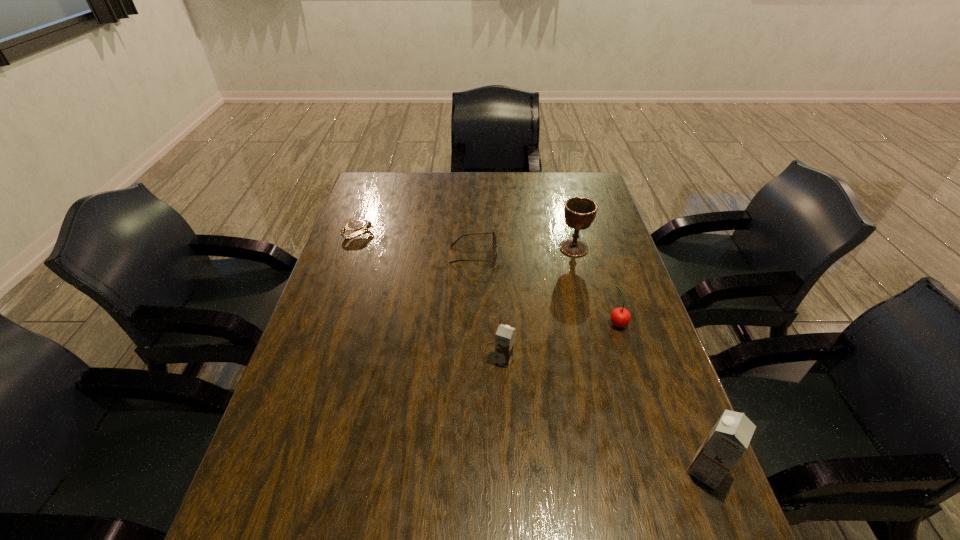
Where is `vacant space in between the chalice and the second shortest object`? The image size is (960, 540). vacant space in between the chalice and the second shortest object is located at coordinates (524, 252).

You are a GUI agent. You are given a task and a screenshot of the screen. Output one action in this format:
    pyautogui.click(x=<x>, y=<y>)
    Task: Click on the free space between the chalice and the sunglasses
    
    Given the screenshot: What is the action you would take?
    pyautogui.click(x=524, y=252)

Image resolution: width=960 pixels, height=540 pixels. What are the coordinates of `empty space between the shorter chocolate milk and the fifth tallest object` in the screenshot? It's located at (489, 308).

Identify the location of free space between the rightmost object and the leftmost object. The image size is (960, 540). (532, 352).

The height and width of the screenshot is (540, 960). I want to click on empty location between the fifth tallest object and the right chocolate milk, so click(x=589, y=363).

Locate an element on the screen. This screenshot has height=540, width=960. unoccupied area between the watch and the sunglasses is located at coordinates (416, 245).

This screenshot has height=540, width=960. In order to click on vacant space in between the right chocolate milk and the fifth tallest object in this screenshot , I will do pyautogui.click(x=589, y=363).

Where is `unoccupied position between the third nearest object and the taller chocolate milk`? unoccupied position between the third nearest object and the taller chocolate milk is located at coordinates (661, 396).

Locate an element on the screen. Image resolution: width=960 pixels, height=540 pixels. unoccupied area between the chalice and the shortest object is located at coordinates (466, 241).

The width and height of the screenshot is (960, 540). I want to click on the closest object to the fifth farthest object, so click(x=620, y=317).